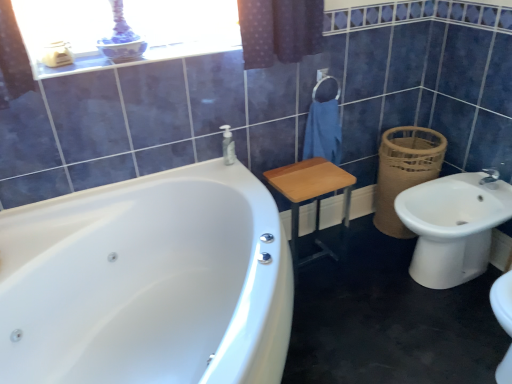
Image resolution: width=512 pixels, height=384 pixels. In order to click on free spot above wooden stool at center (from a real-world perspective) in this screenshot , I will do `click(306, 179)`.